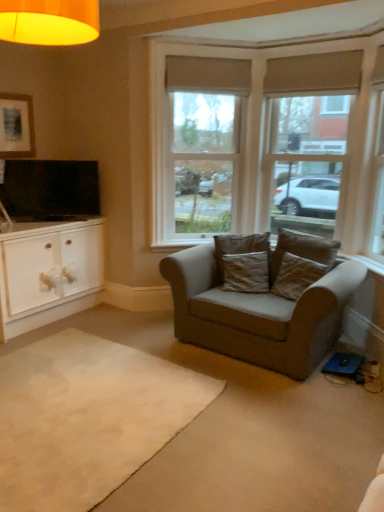
Question: From a real-world perspective, is beige carpet at lower center positioned under brown suede pillow at center, positioned as the first pillow in right-to-left order, based on gravity?

Choices:
 (A) yes
 (B) no

Answer: (A)

Question: From the image's perspective, does beige carpet at lower center appear higher than brown suede pillow at center, positioned as the first pillow in right-to-left order?

Choices:
 (A) yes
 (B) no

Answer: (B)

Question: Is brown suede pillow at center, placed as the 3th pillow when sorted from left to right, at the back of beige carpet at lower center?

Choices:
 (A) yes
 (B) no

Answer: (B)

Question: Does beige carpet at lower center come in front of brown suede pillow at center, positioned as the first pillow in right-to-left order?

Choices:
 (A) yes
 (B) no

Answer: (A)

Question: Can you confirm if beige carpet at lower center is thinner than brown suede pillow at center, positioned as the first pillow in right-to-left order?

Choices:
 (A) yes
 (B) no

Answer: (B)

Question: Is beige carpet at lower center wider than brown suede pillow at center, positioned as the first pillow in right-to-left order?

Choices:
 (A) no
 (B) yes

Answer: (B)

Question: Does matte black picture frame at upper left have a greater width compared to flat screen tv at left?

Choices:
 (A) no
 (B) yes

Answer: (A)

Question: From the image's perspective, is matte black picture frame at upper left over flat screen tv at left?

Choices:
 (A) no
 (B) yes

Answer: (B)

Question: Does matte black picture frame at upper left have a lesser height compared to flat screen tv at left?

Choices:
 (A) no
 (B) yes

Answer: (B)

Question: Is matte black picture frame at upper left to the left of flat screen tv at left from the viewer's perspective?

Choices:
 (A) no
 (B) yes

Answer: (B)

Question: Considering the relative positions of matte black picture frame at upper left and flat screen tv at left in the image provided, is matte black picture frame at upper left to the right of flat screen tv at left from the viewer's perspective?

Choices:
 (A) no
 (B) yes

Answer: (A)

Question: From the image's perspective, is matte black picture frame at upper left below flat screen tv at left?

Choices:
 (A) no
 (B) yes

Answer: (A)

Question: From a real-world perspective, is brown suede pillow at center, which appears as the second pillow when viewed from the left, physically below brown fabric pillow at center, the first pillow positioned from the left?

Choices:
 (A) no
 (B) yes

Answer: (B)